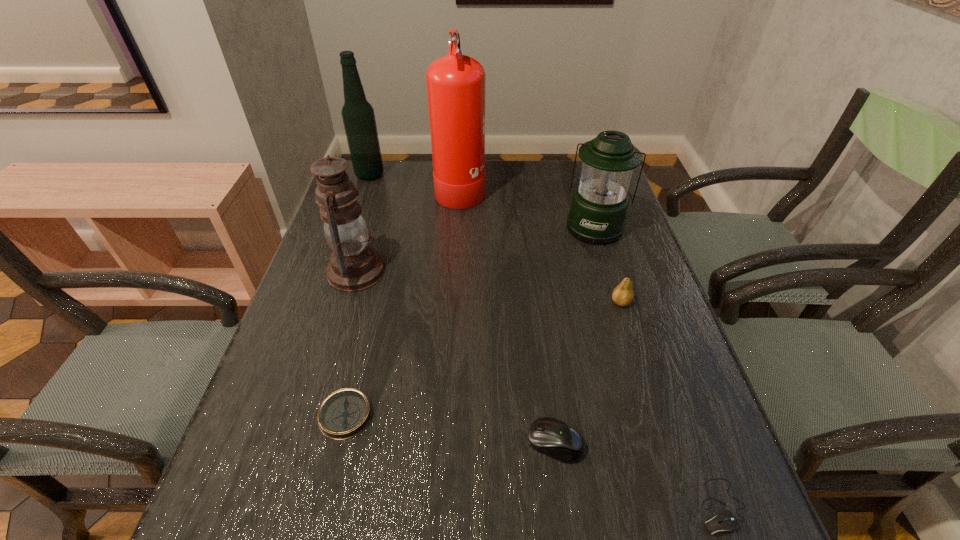
I want to click on the fifth object from right to left, so click(x=455, y=83).

Where is `the tallest object`? the tallest object is located at coordinates (455, 83).

Where is `the second tallest object`? the second tallest object is located at coordinates (358, 116).

Find the location of a particular element. The height and width of the screenshot is (540, 960). oil lamp is located at coordinates (354, 266).

The height and width of the screenshot is (540, 960). I want to click on the fourth tallest object, so click(599, 205).

Locate an element on the screen. pear is located at coordinates (623, 294).

I want to click on the left computer mouse, so click(552, 437).

Find the location of `the sixth tallest object`. the sixth tallest object is located at coordinates (552, 437).

This screenshot has height=540, width=960. Identify the location of compass. (345, 413).

The image size is (960, 540). I want to click on the shorter computer mouse, so click(x=725, y=521).